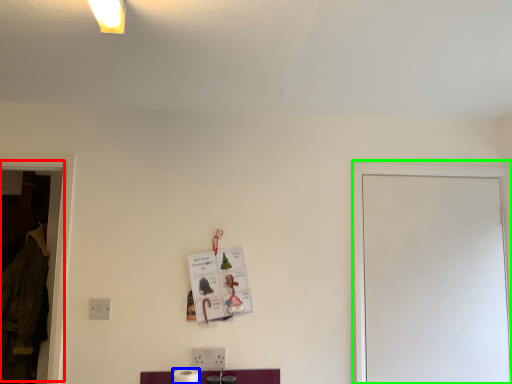
Question: Which object is positioned farthest from window (highlighted by a red box)? Select from toilet paper (highlighted by a blue box) and glass door (highlighted by a green box).

Choices:
 (A) toilet paper
 (B) glass door

Answer: (B)